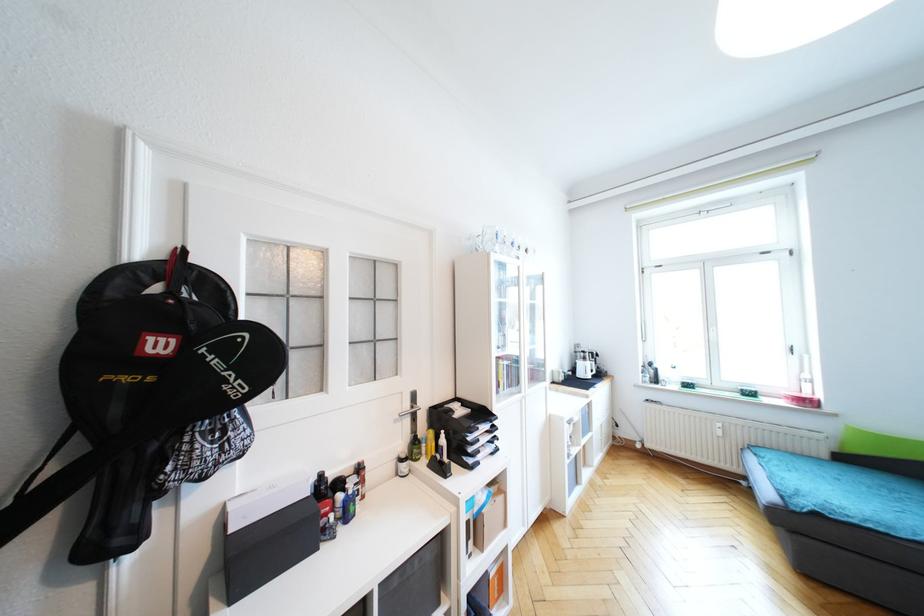
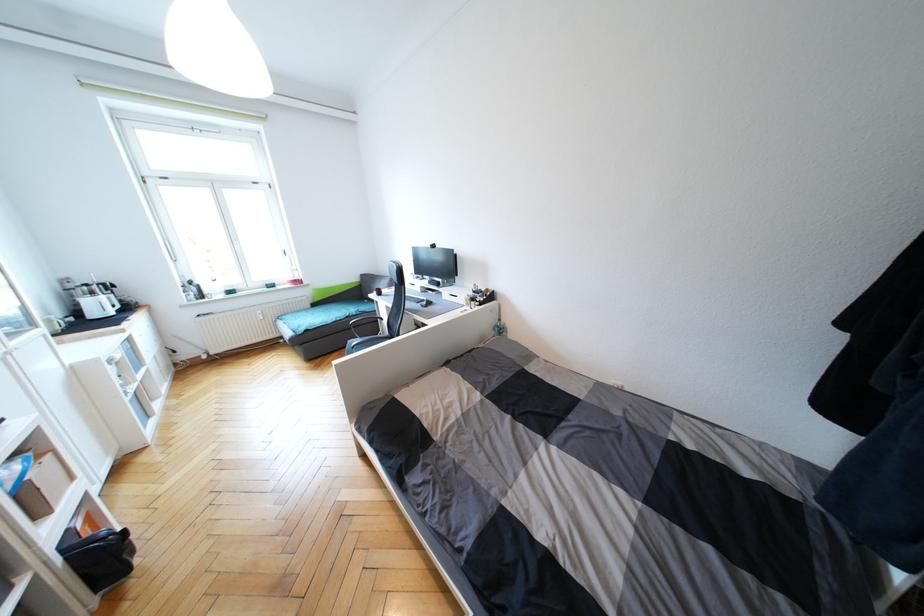
Find the pixel in the second image that matches point 588,360 in the first image.

(95, 294)